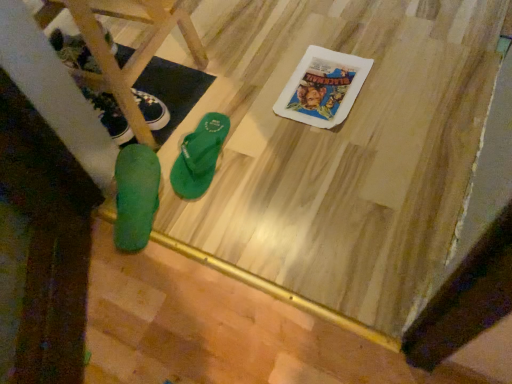
Image resolution: width=512 pixels, height=384 pixels. I want to click on free area below green rubber flip-flop at center, which appears as the 1th footwear when viewed from the right (from a real-world perspective), so click(202, 147).